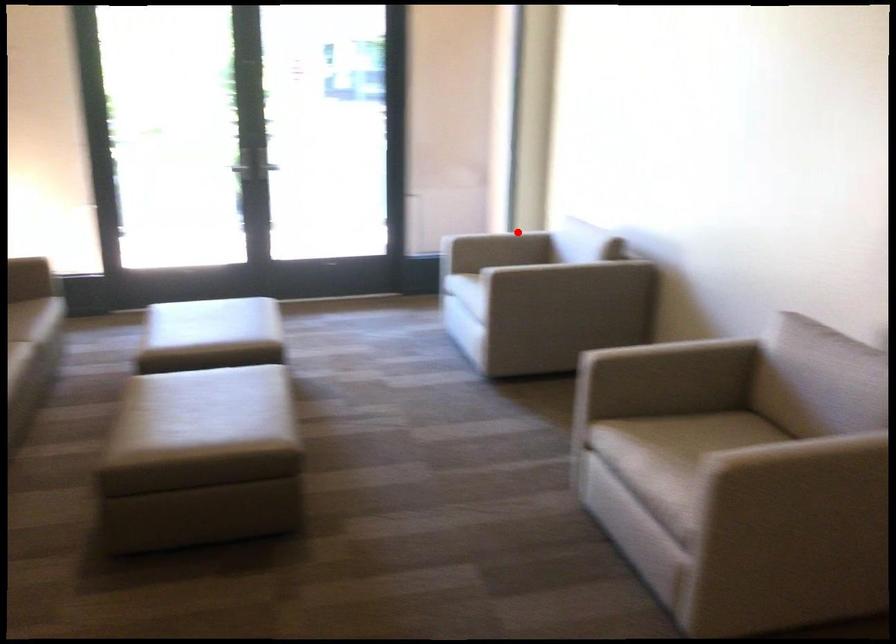
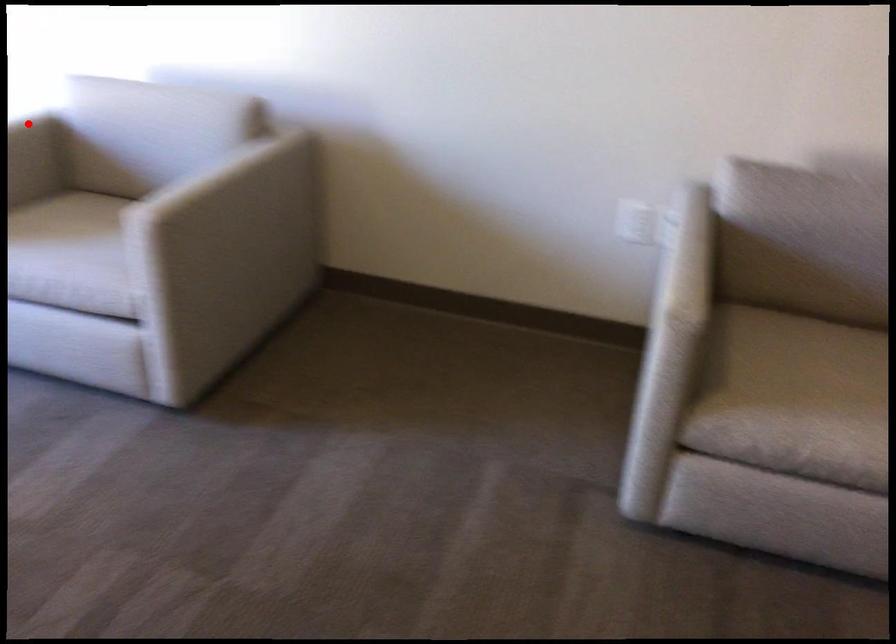
I am providing you with two images of the same scene from different viewpoints. A red point is marked on the first image and another point is marked on the second image. Do the highlighted points in image1 and image2 indicate the same real-world spot?

Yes